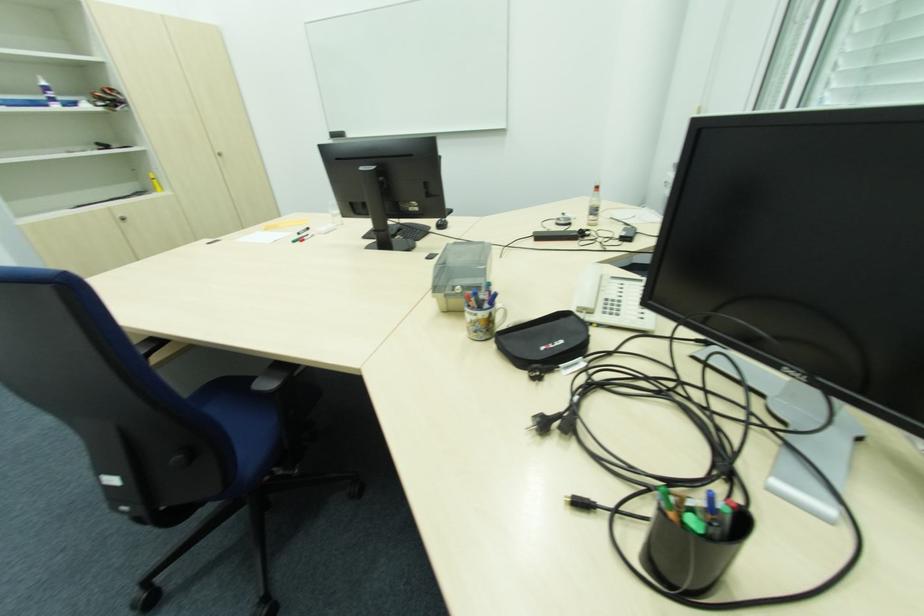
Image resolution: width=924 pixels, height=616 pixels. Describe the element at coordinates (588, 291) in the screenshot. I see `the telephone handset` at that location.